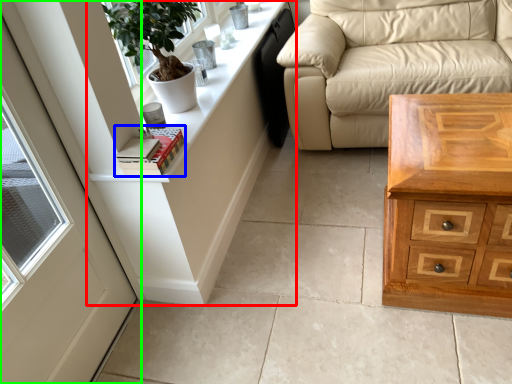
Question: Estimate the real-world distances between objects in this image. Which object is closer to dresser (highlighted by a red box), book (highlighted by a blue box) or door (highlighted by a green box)?

Choices:
 (A) book
 (B) door

Answer: (A)